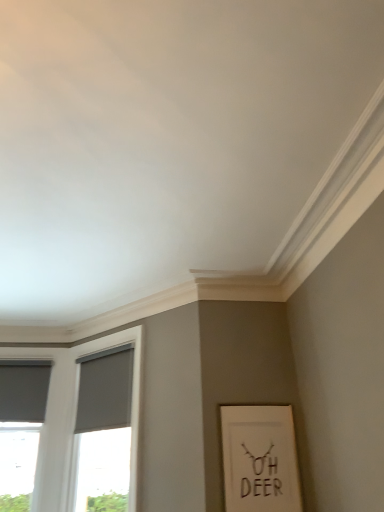
Question: Does matte gray curtain at left, the second curtain in the right-to-left sequence, have a larger size compared to white matte picture frame at lower right?

Choices:
 (A) yes
 (B) no

Answer: (A)

Question: Can you confirm if matte gray curtain at left, the second curtain in the right-to-left sequence, is thinner than white matte picture frame at lower right?

Choices:
 (A) no
 (B) yes

Answer: (A)

Question: Is matte gray curtain at left, the second curtain in the right-to-left sequence, located outside white matte picture frame at lower right?

Choices:
 (A) no
 (B) yes

Answer: (B)

Question: Is matte gray curtain at left, marked as the 1th curtain in a left-to-right arrangement, further to camera compared to white matte picture frame at lower right?

Choices:
 (A) no
 (B) yes

Answer: (B)

Question: From a real-world perspective, is matte gray curtain at left, the second curtain in the right-to-left sequence, beneath white matte picture frame at lower right?

Choices:
 (A) yes
 (B) no

Answer: (B)

Question: From the image's perspective, relative to white matte picture frame at lower right, is matte gray window at left above or below?

Choices:
 (A) above
 (B) below

Answer: (B)

Question: Considering the positions of point coord(51,442) and point coord(235,436), is point coord(51,442) closer or farther from the camera than point coord(235,436)?

Choices:
 (A) farther
 (B) closer

Answer: (A)

Question: Considering their positions, is matte gray window at left located in front of or behind white matte picture frame at lower right?

Choices:
 (A) behind
 (B) front

Answer: (A)

Question: From a real-world perspective, relative to white matte picture frame at lower right, is matte gray window at left vertically above or below?

Choices:
 (A) below
 (B) above

Answer: (B)

Question: Choose the correct answer: Is matte gray window at left inside matte gray curtain at lower left, acting as the second curtain starting from the left, or outside it?

Choices:
 (A) inside
 (B) outside

Answer: (B)

Question: From the image's perspective, is matte gray window at left located above or below matte gray curtain at lower left, which is the 1th curtain in right-to-left order?

Choices:
 (A) above
 (B) below

Answer: (B)

Question: Is point (61, 377) positioned closer to the camera than point (79, 410)?

Choices:
 (A) closer
 (B) farther

Answer: (B)

Question: In terms of height, does matte gray window at left look taller or shorter compared to matte gray curtain at lower left, acting as the second curtain starting from the left?

Choices:
 (A) tall
 (B) short

Answer: (A)

Question: Is matte gray curtain at left, marked as the 1th curtain in a left-to-right arrangement, taller or shorter than matte gray curtain at lower left, acting as the second curtain starting from the left?

Choices:
 (A) short
 (B) tall

Answer: (A)

Question: Considering the positions of matte gray curtain at left, the second curtain in the right-to-left sequence, and matte gray curtain at lower left, acting as the second curtain starting from the left, in the image, is matte gray curtain at left, the second curtain in the right-to-left sequence, bigger or smaller than matte gray curtain at lower left, acting as the second curtain starting from the left,?

Choices:
 (A) small
 (B) big

Answer: (A)